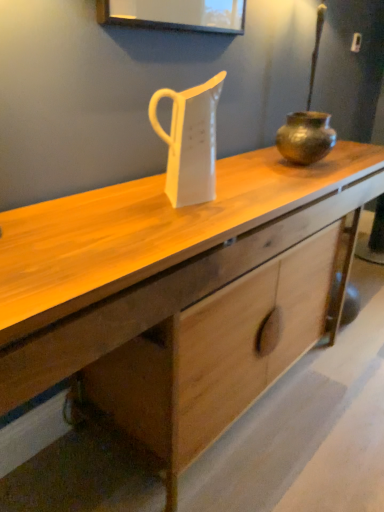
Where is `free point above wooden desk at center (from a real-world perspective)`? The width and height of the screenshot is (384, 512). free point above wooden desk at center (from a real-world perspective) is located at coordinates (153, 210).